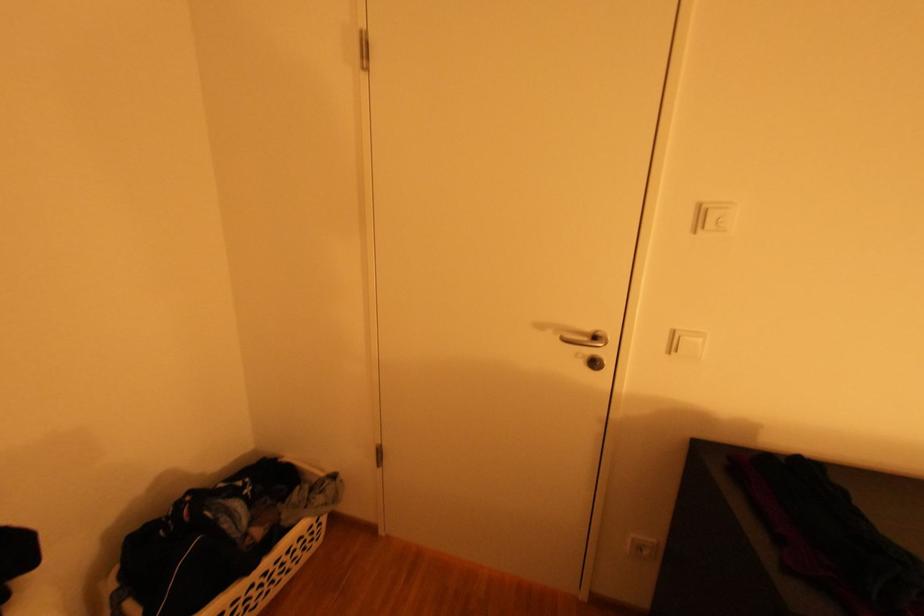
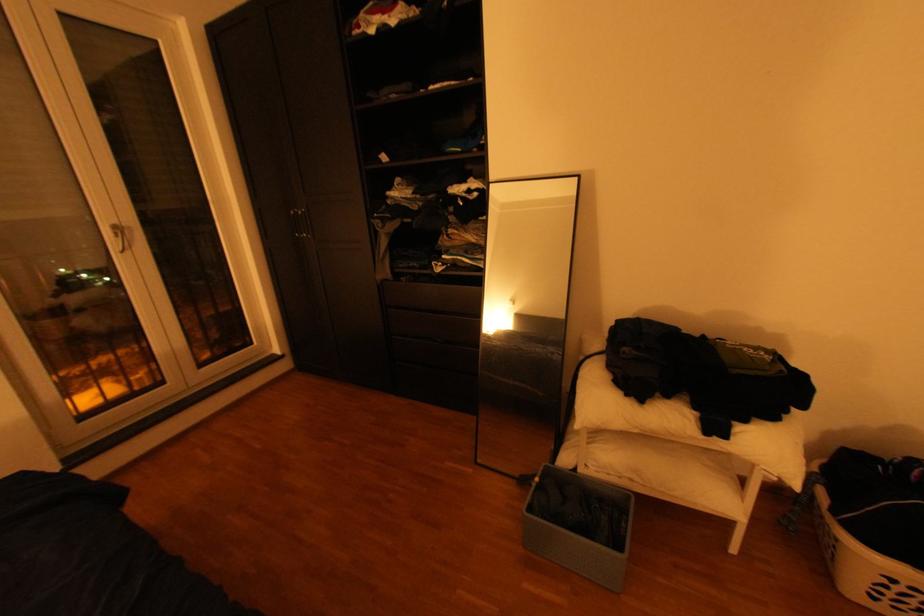
The images are taken continuously from a first-person perspective. In which direction is your viewpoint rotating?

The camera rotated toward left-down.